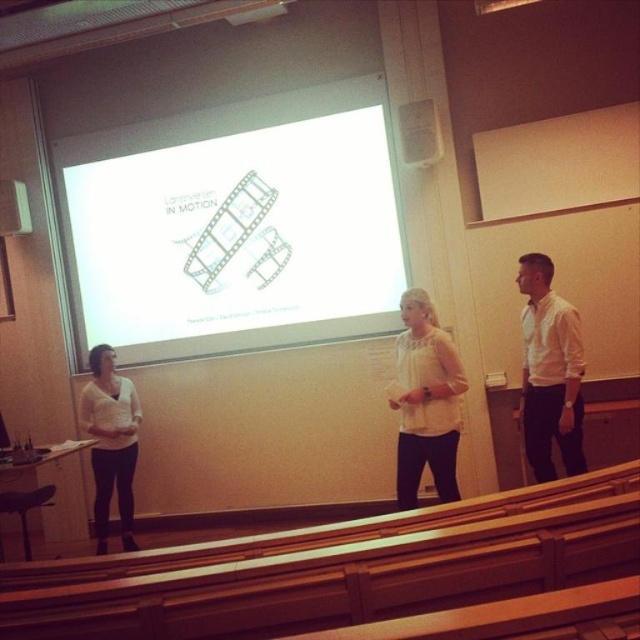
You are a student sitting in the classroom and want to see both the white matte projection screen at center and the white shirt at right clearly. Which one is easier to see from your seat?

The white matte projection screen at center is positioned over the white shirt at right, so it is closer to you and easier to see clearly.

You are a student sitting in the back row of the classroom. You notice the white matte projection screen at center and the white shirt at right. Which object is taller from your perspective?

The white matte projection screen at center is much taller than the white shirt at right from your perspective.

You are a photographer setting up for a group photo in the classroom. You need to position two subjects wearing white shirts so that their shirts are visible in the frame. The white shirt at right and the white matte shirt at center are the two subjects. Given that the camera you are using has a limited depth of field, which subject should you focus on to ensure their shirt is in focus while the other is slightly blurred?

The white shirt at right has a smaller width than the white matte shirt at center. Therefore, focusing on the white matte shirt at center would ensure it remains in focus, while the smaller white shirt at right may appear slightly blurred due to the limited depth of field.